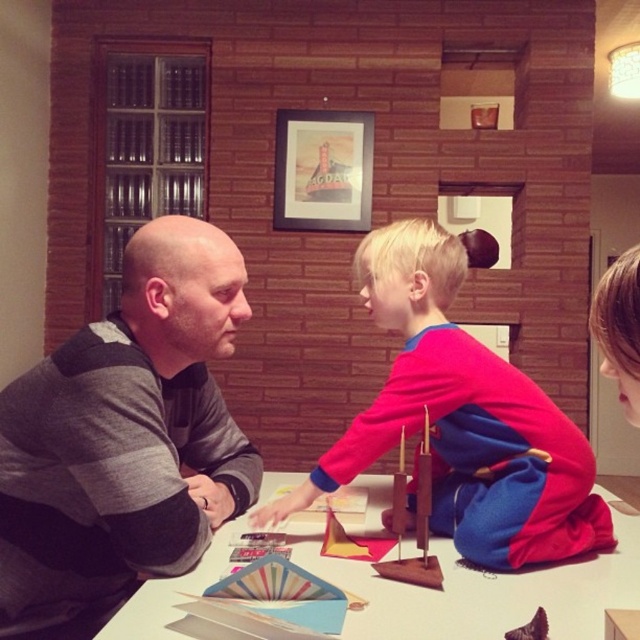
Does point (563, 483) come closer to viewer compared to point (493, 634)?

No, (563, 483) is behind (493, 634).

Locate an element on the screen. Image resolution: width=640 pixels, height=640 pixels. matte red and blue sweater at center is located at coordinates (461, 419).

How distant is matte red and blue sweater at center from wooden model ship at center?

A distance of 6.38 inches exists between matte red and blue sweater at center and wooden model ship at center.

Who is positioned more to the left, matte red and blue sweater at center or wooden model ship at center?

matte red and blue sweater at center

Is point (353, 260) positioned after point (397, 480)?

Yes, it is behind point (397, 480).

I want to click on matte red and blue sweater at center, so click(x=461, y=419).

Describe the element at coordinates (124, 436) in the screenshot. I see `gray sweater at left` at that location.

Consider the image. Does gray sweater at left lie behind wooden picture frame at upper center?

No, it is in front of wooden picture frame at upper center.

Identify the location of gray sweater at left. (124, 436).